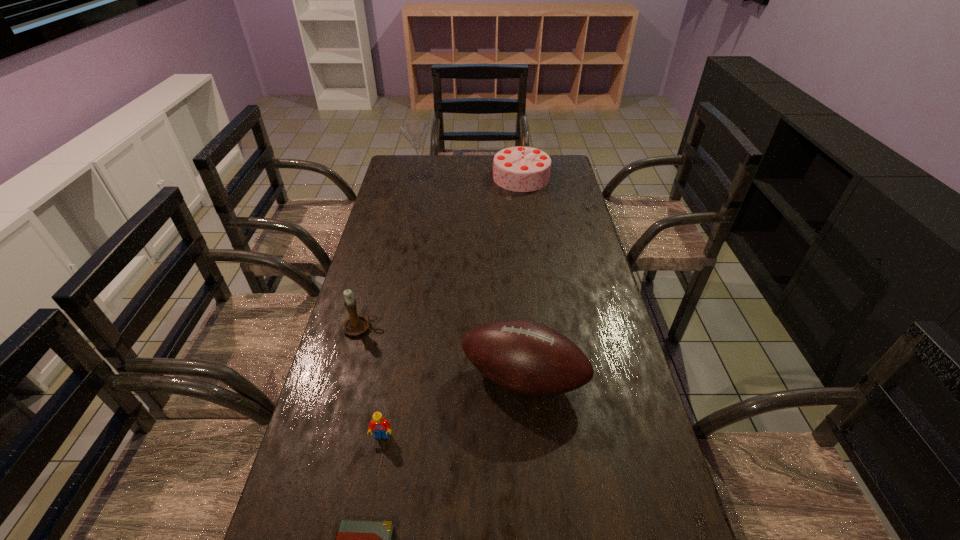
What are the coordinates of `free space between the birthday cake and the fourth nearest object` in the screenshot? It's located at (441, 252).

This screenshot has height=540, width=960. Identify the location of free spot between the tallest object and the birthday cake. (470, 177).

Select which object is the fifth closest to the birthday cake. Please provide its 2D coordinates. Your answer should be formatted as a tuple, i.e. [(x, y)], where the tuple contains the x and y coordinates of a point satisfying the conditions above.

[(356, 539)]

Find the location of a particular element. The height and width of the screenshot is (540, 960). object that is the closest to the football (American) is located at coordinates (381, 427).

You are a GUI agent. You are given a task and a screenshot of the screen. Output one action in this format:
    pyautogui.click(x=<x>, y=<y>)
    Task: Click on the vacant area in the image that satisfies the following two spatial constraints: 1. on the front side of the flute glass; 2. on the right side of the third nearest object
    
    Given the screenshot: What is the action you would take?
    pyautogui.click(x=379, y=378)

Locate an element on the screen. Image resolution: width=960 pixels, height=540 pixels. vacant space that satisfies the following two spatial constraints: 1. on the front side of the flute glass; 2. on the left side of the football (American) is located at coordinates (379, 378).